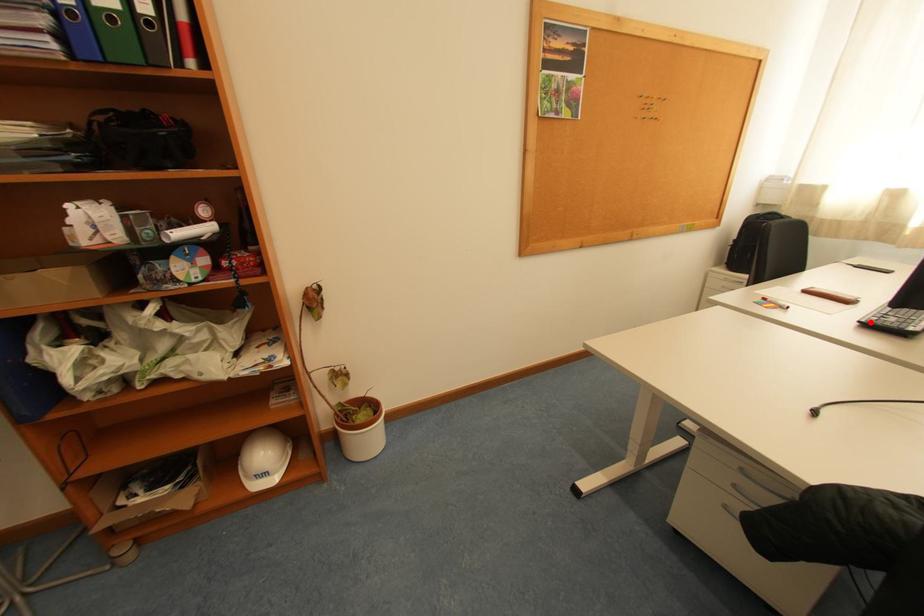
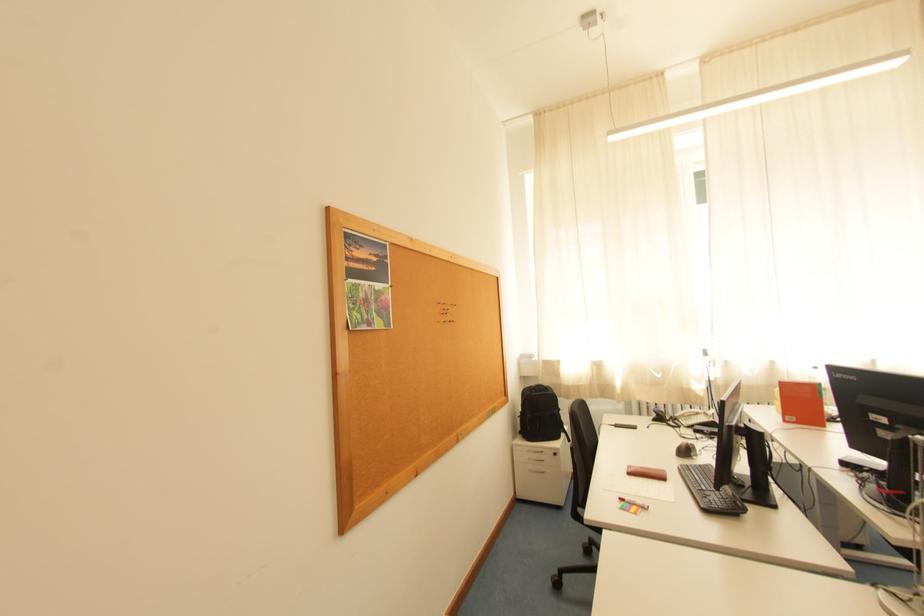
Locate, in the second image, the point that corresponds to the highlighted location in the first image.

(711, 508)